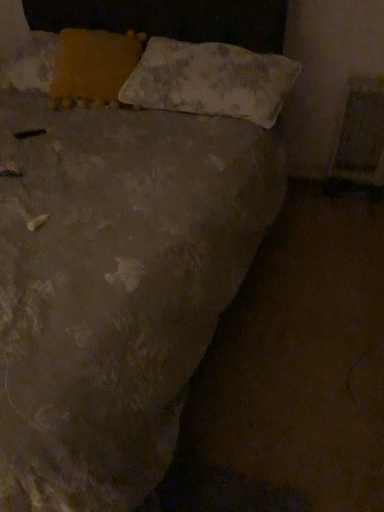
Question: From the image's perspective, does yellow fabric pillow at upper left, the 1th pillow positioned from the left, appear higher than faded fabric pillow at upper center, placed as the second pillow when sorted from left to right?

Choices:
 (A) yes
 (B) no

Answer: (A)

Question: From the image's perspective, is yellow fabric pillow at upper left, the 1th pillow positioned from the left, located beneath faded fabric pillow at upper center, placed as the first pillow when sorted from right to left?

Choices:
 (A) no
 (B) yes

Answer: (A)

Question: Is yellow fabric pillow at upper left, the second pillow from the right, shorter than faded fabric pillow at upper center, placed as the second pillow when sorted from left to right?

Choices:
 (A) no
 (B) yes

Answer: (A)

Question: Is yellow fabric pillow at upper left, the 1th pillow positioned from the left, thinner than faded fabric pillow at upper center, placed as the second pillow when sorted from left to right?

Choices:
 (A) yes
 (B) no

Answer: (A)

Question: From a real-world perspective, is yellow fabric pillow at upper left, the second pillow from the right, on top of faded fabric pillow at upper center, placed as the first pillow when sorted from right to left?

Choices:
 (A) no
 (B) yes

Answer: (B)

Question: Can we say yellow fabric pillow at upper left, the second pillow from the right, lies outside faded fabric pillow at upper center, placed as the first pillow when sorted from right to left?

Choices:
 (A) no
 (B) yes

Answer: (B)

Question: Considering the relative positions of faded fabric pillow at upper center, placed as the second pillow when sorted from left to right, and yellow fabric pillow at upper left, the 1th pillow positioned from the left, in the image provided, is faded fabric pillow at upper center, placed as the second pillow when sorted from left to right, to the right of yellow fabric pillow at upper left, the 1th pillow positioned from the left, from the viewer's perspective?

Choices:
 (A) no
 (B) yes

Answer: (B)

Question: Is faded fabric pillow at upper center, placed as the first pillow when sorted from right to left, positioned before yellow fabric pillow at upper left, the 1th pillow positioned from the left?

Choices:
 (A) no
 (B) yes

Answer: (B)

Question: Is faded fabric pillow at upper center, placed as the second pillow when sorted from left to right, with yellow fabric pillow at upper left, the 1th pillow positioned from the left?

Choices:
 (A) no
 (B) yes

Answer: (A)

Question: Can we say faded fabric pillow at upper center, placed as the second pillow when sorted from left to right, lies outside yellow fabric pillow at upper left, the 1th pillow positioned from the left?

Choices:
 (A) yes
 (B) no

Answer: (A)

Question: Is faded fabric pillow at upper center, placed as the first pillow when sorted from right to left, wider than yellow fabric pillow at upper left, the second pillow from the right?

Choices:
 (A) no
 (B) yes

Answer: (B)

Question: Is faded fabric pillow at upper center, placed as the first pillow when sorted from right to left, taller than yellow fabric pillow at upper left, the second pillow from the right?

Choices:
 (A) yes
 (B) no

Answer: (B)

Question: From a real-world perspective, is yellow fabric pillow at upper left, the 1th pillow positioned from the left, above or below faded fabric pillow at upper center, placed as the second pillow when sorted from left to right?

Choices:
 (A) below
 (B) above

Answer: (B)